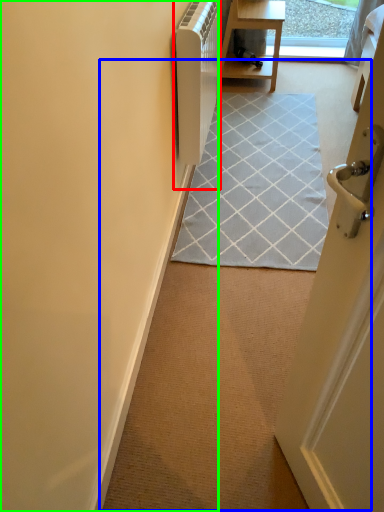
Question: Estimate the real-world distances between objects in this image. Which object is farther from appliance (highlighted by a red box), path (highlighted by a blue box) or door (highlighted by a green box)?

Choices:
 (A) path
 (B) door

Answer: (A)